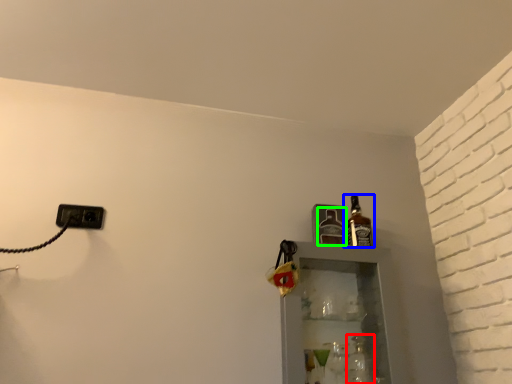
Question: Which object is the closest to the bottle (highlighted by a red box)? Choose among these: bottle (highlighted by a blue box) or bottle (highlighted by a green box).

Choices:
 (A) bottle
 (B) bottle

Answer: (A)